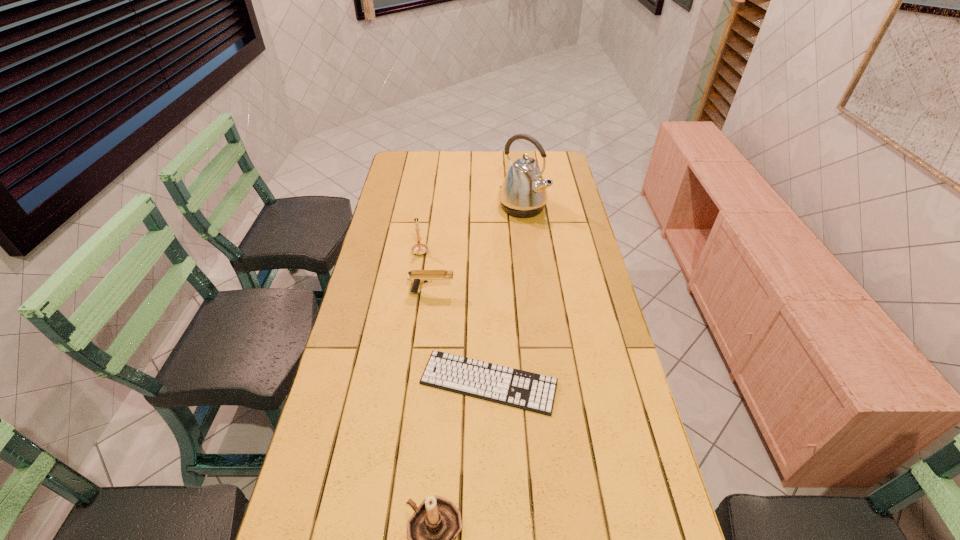
You are a GUI agent. You are given a task and a screenshot of the screen. Output one action in this format:
    pyautogui.click(x=<x>, y=<y>)
    Task: Click on the blank area located 0.290m on the handle side of the left candle holder
    
    Given the screenshot: What is the action you would take?
    pyautogui.click(x=428, y=200)

Where is `vacant position located 0.100m on the handle side of the left candle holder`? The height and width of the screenshot is (540, 960). vacant position located 0.100m on the handle side of the left candle holder is located at coordinates (423, 227).

Locate an element on the screen. This screenshot has width=960, height=540. free location located 0.130m at the barrel of the third nearest object is located at coordinates (494, 293).

This screenshot has width=960, height=540. Identify the location of free space located on the left of the shortest object. (372, 383).

Where is `object at the left edge`? The image size is (960, 540). object at the left edge is located at coordinates (419, 248).

This screenshot has width=960, height=540. Find the location of `object that is positioned at the right edge`. object that is positioned at the right edge is located at coordinates pos(523,193).

Find the location of `vacant space at the far edge of the desktop`. vacant space at the far edge of the desktop is located at coordinates (468, 164).

Locate an element on the screen. vacant space at the left edge is located at coordinates (326, 406).

In order to click on vacant space at the right edge of the desktop in this screenshot , I will do tap(622, 436).

In the image, there is a desktop. At what (x,y) coordinates should I click in order to perform the action: click on vacant region at the far left corner. Please return your answer as a coordinate pair (x, y). The image size is (960, 540). Looking at the image, I should click on (408, 168).